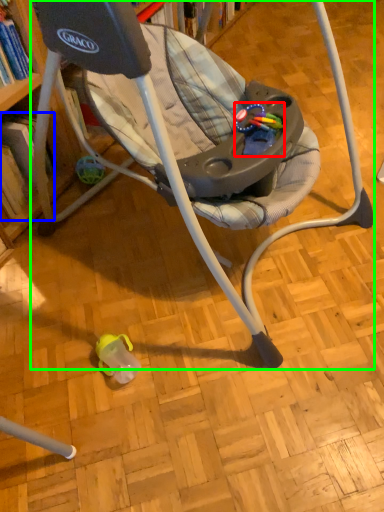
Question: Which object is positioned farthest from toy (highlighted by a red box)? Select from book (highlighted by a blue box) and chair (highlighted by a green box).

Choices:
 (A) book
 (B) chair

Answer: (A)